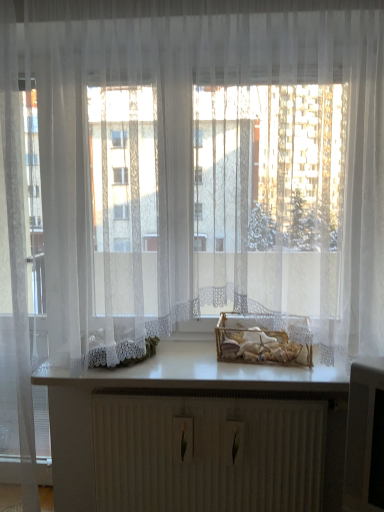
Identify the location of white textured radiator at center. This screenshot has height=512, width=384. (208, 453).

This screenshot has height=512, width=384. What do you see at coordinates (20, 279) in the screenshot?
I see `transparent glass door at left` at bounding box center [20, 279].

At what (x,y) coordinates should I click in order to perform the action: click on translucent glass basket at center. Please return your answer as a coordinate pair (x, y). Image resolution: width=384 pixels, height=512 pixels. Looking at the image, I should click on (259, 343).

Which is correct: transparent glass door at left is inside white textured radiator at center, or outside of it?

transparent glass door at left is spatially situated outside white textured radiator at center.

Can you confirm if transparent glass door at left is positioned to the left of white textured radiator at center?

Yes.

From a real-world perspective, which object rests below the other?

white textured radiator at center.

Is there a large distance between transparent glass door at left and white textured radiator at center?

No, there isn't a large distance between transparent glass door at left and white textured radiator at center.

Which is in front, point (270, 354) or point (24, 402)?

The point (24, 402) is closer to the camera.

From the image's perspective, which one is positioned lower, translucent glass basket at center or transparent glass door at left?

translucent glass basket at center.

Considering the sizes of translucent glass basket at center and transparent glass door at left in the image, is translucent glass basket at center bigger or smaller than transparent glass door at left?

In the image, translucent glass basket at center appears to be smaller than transparent glass door at left.

Considering the relative positions of translucent glass basket at center and transparent glass door at left in the image provided, is translucent glass basket at center to the left or to the right of transparent glass door at left?

translucent glass basket at center is positioned on transparent glass door at left's right side.

Can you confirm if white textured radiator at center is wider than translucent glass basket at center?

No, white textured radiator at center is not wider than translucent glass basket at center.

How much distance is there between white textured radiator at center and translucent glass basket at center?

A distance of 14.83 inches exists between white textured radiator at center and translucent glass basket at center.

Which of these two, white textured radiator at center or translucent glass basket at center, is bigger?

white textured radiator at center.

Can you tell me how much white textured radiator at center and translucent glass basket at center differ in facing direction?

The facing directions of white textured radiator at center and translucent glass basket at center are 6 degrees apart.

Is white textured radiator at center positioned in front of white matte counter top at center?

No, white textured radiator at center is further to the viewer.

Based on their positions, is white textured radiator at center located to the left or right of white matte counter top at center?

Based on their positions, white textured radiator at center is located to the right of white matte counter top at center.

Considering the sizes of objects white textured radiator at center and white matte counter top at center in the image provided, who is taller, white textured radiator at center or white matte counter top at center?

With more height is white textured radiator at center.

From the picture: How different are the orientations of white textured radiator at center and white matte counter top at center in degrees?

The angular difference between white textured radiator at center and white matte counter top at center is 1.33 degrees.

Can you confirm if white matte counter top at center is bigger than white textured radiator at center?

Incorrect, white matte counter top at center is not larger than white textured radiator at center.

Where is `radiator lying on the right of white matte counter top at center`? radiator lying on the right of white matte counter top at center is located at coordinates (208, 453).

In terms of height, does white matte counter top at center look taller or shorter compared to white textured radiator at center?

Considering their sizes, white matte counter top at center has less height than white textured radiator at center.

Does white matte counter top at center have a greater width compared to white textured radiator at center?

Yes.

Based on their positions, is white textured radiator at center located to the left or right of transparent glass door at left?

white textured radiator at center is to the right of transparent glass door at left.

At what (x,y) coordinates should I click in order to perform the action: click on glass door above the white textured radiator at center (from a real-world perspective). Please return your answer as a coordinate pair (x, y). Looking at the image, I should click on (20, 279).

Does point (115, 457) appear closer or farther from the camera than point (6, 141)?

Point (115, 457) is farther from the camera than point (6, 141).

Who is shorter, white textured radiator at center or transparent glass door at left?

Standing shorter between the two is white textured radiator at center.

Considering the sizes of objects white matte counter top at center and translucent glass basket at center in the image provided, who is taller, white matte counter top at center or translucent glass basket at center?

translucent glass basket at center is taller.

Can you confirm if white matte counter top at center is positioned to the left of translucent glass basket at center?

Indeed, white matte counter top at center is positioned on the left side of translucent glass basket at center.

From a real-world perspective, between white matte counter top at center and translucent glass basket at center, who is vertically lower?

From a 3D spatial view, white matte counter top at center is below.

From the image's perspective, which is above, white matte counter top at center or translucent glass basket at center?

translucent glass basket at center appears higher in the image.

The width and height of the screenshot is (384, 512). Identify the location of radiator below the transparent glass door at left (from a real-world perspective). (208, 453).

Identify the location of glass door above the translucent glass basket at center (from the image's perspective). (20, 279).

Considering their positions, is translucent glass basket at center positioned closer to white matte counter top at center than white textured radiator at center?

The object closer to white matte counter top at center is translucent glass basket at center.

From the image, which object appears to be farther from translucent glass basket at center, white textured radiator at center or transparent glass door at left?

transparent glass door at left is further to translucent glass basket at center.

Looking at the image, which one is located further to white textured radiator at center, white matte counter top at center or translucent glass basket at center?

translucent glass basket at center.

When comparing their distances from white textured radiator at center, does transparent glass door at left or white matte counter top at center seem further?

transparent glass door at left lies further to white textured radiator at center than the other object.

Estimate the real-world distances between objects in this image. Which object is closer to white matte counter top at center, transparent glass door at left or translucent glass basket at center?

The object closer to white matte counter top at center is translucent glass basket at center.

Considering their positions, is transparent glass door at left positioned further to white textured radiator at center than translucent glass basket at center?

Among the two, transparent glass door at left is located further to white textured radiator at center.

Based on their spatial positions, is translucent glass basket at center or white matte counter top at center closer to transparent glass door at left?

white matte counter top at center is positioned closer to the anchor transparent glass door at left.

When comparing their distances from white matte counter top at center, does transparent glass door at left or white textured radiator at center seem closer?

white textured radiator at center.

Locate an element on the screen. This screenshot has height=512, width=384. counter top situated between transparent glass door at left and translucent glass basket at center from left to right is located at coordinates (203, 373).

Identify the location of radiator between transparent glass door at left and translucent glass basket at center from left to right. Image resolution: width=384 pixels, height=512 pixels. (208, 453).

Where is `counter top between translucent glass basket at center and white textured radiator at center in the up-down direction`? This screenshot has width=384, height=512. counter top between translucent glass basket at center and white textured radiator at center in the up-down direction is located at coordinates (203, 373).

Where is `counter top located between transparent glass door at left and white textured radiator at center in the left-right direction`? The image size is (384, 512). counter top located between transparent glass door at left and white textured radiator at center in the left-right direction is located at coordinates (203, 373).